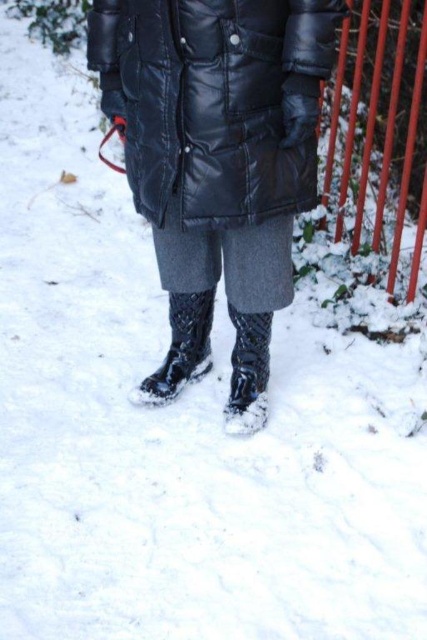
Question: Is black leather jacket at center below glossy black boot at lower center?

Choices:
 (A) yes
 (B) no

Answer: (B)

Question: Does black leather jacket at center appear under glossy black boot at lower center?

Choices:
 (A) yes
 (B) no

Answer: (B)

Question: Estimate the real-world distances between objects in this image. Which object is closer to the black leather jacket at center?

Choices:
 (A) glossy black boot at lower center
 (B) glossy rubber boot at center

Answer: (B)

Question: Among these objects, which one is farthest from the camera?

Choices:
 (A) glossy black boot at lower center
 (B) black leather jacket at center
 (C) glossy rubber boot at center

Answer: (C)

Question: Which of the following is the closest to the observer?

Choices:
 (A) black leather jacket at center
 (B) glossy rubber boot at center
 (C) glossy black boot at lower center

Answer: (A)

Question: Is black leather jacket at center bigger than glossy black boot at lower center?

Choices:
 (A) yes
 (B) no

Answer: (A)